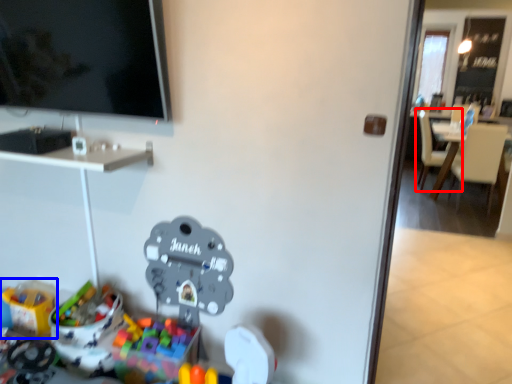
Question: Among these objects, which one is nearest to the camera, chair (highlighted by a red box) or toy (highlighted by a blue box)?

Choices:
 (A) chair
 (B) toy

Answer: (B)